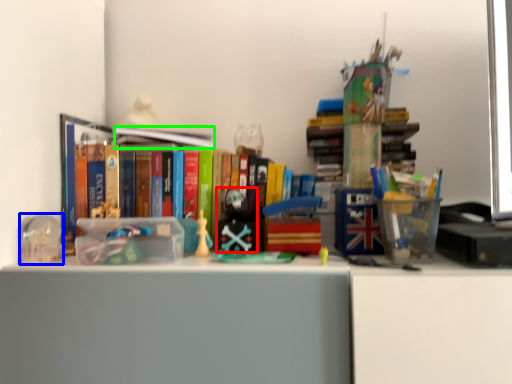
Question: Estimate the real-world distances between objects in this image. Which object is farther from toy (highlighted by a red box), stationery (highlighted by a blue box) or book (highlighted by a green box)?

Choices:
 (A) stationery
 (B) book

Answer: (A)